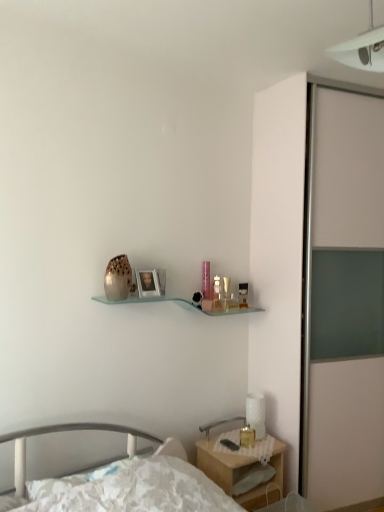
Question: Is white textured table lamp at lower right located outside translucent glass perfume bottle at upper center, the first toiletry positioned from the front?

Choices:
 (A) yes
 (B) no

Answer: (A)

Question: Considering the relative positions of white textured table lamp at lower right and translucent glass perfume bottle at upper center, which appears as the second toiletry when viewed from the right, in the image provided, is white textured table lamp at lower right to the right of translucent glass perfume bottle at upper center, which appears as the second toiletry when viewed from the right, from the viewer's perspective?

Choices:
 (A) no
 (B) yes

Answer: (B)

Question: Is white textured table lamp at lower right positioned with its back to translucent glass perfume bottle at upper center, the first toiletry positioned from the front?

Choices:
 (A) no
 (B) yes

Answer: (A)

Question: From a real-world perspective, is white textured table lamp at lower right on translucent glass perfume bottle at upper center, which appears as the second toiletry when viewed from the right?

Choices:
 (A) yes
 (B) no

Answer: (B)

Question: From a real-world perspective, is white textured table lamp at lower right below translucent glass perfume bottle at upper center, the first toiletry positioned from the front?

Choices:
 (A) no
 (B) yes

Answer: (B)

Question: Considering the relative positions of white textured table lamp at lower right and translucent glass perfume bottle at upper center, the first toiletry positioned from the front, in the image provided, is white textured table lamp at lower right to the left of translucent glass perfume bottle at upper center, the first toiletry positioned from the front, from the viewer's perspective?

Choices:
 (A) yes
 (B) no

Answer: (B)

Question: From a real-world perspective, is translucent glass perfume bottle at upper center, the first toiletry from the left, on top of brown textured vase at center?

Choices:
 (A) no
 (B) yes

Answer: (A)

Question: Considering the relative sizes of translucent glass perfume bottle at upper center, which appears as the second toiletry when viewed from the right, and brown textured vase at center in the image provided, is translucent glass perfume bottle at upper center, which appears as the second toiletry when viewed from the right, bigger than brown textured vase at center?

Choices:
 (A) yes
 (B) no

Answer: (B)

Question: Is the position of translucent glass perfume bottle at upper center, the first toiletry from the left, less distant than that of brown textured vase at center?

Choices:
 (A) yes
 (B) no

Answer: (B)

Question: Can you confirm if translucent glass perfume bottle at upper center, the first toiletry from the left, is shorter than brown textured vase at center?

Choices:
 (A) no
 (B) yes

Answer: (B)

Question: Does translucent glass perfume bottle at upper center, which appears as the second toiletry when viewed from the right, have a greater height compared to brown textured vase at center?

Choices:
 (A) yes
 (B) no

Answer: (B)

Question: Does translucent glass perfume bottle at upper center, positioned as the second toiletry in back-to-front order, have a smaller size compared to brown textured vase at center?

Choices:
 (A) no
 (B) yes

Answer: (B)

Question: From a real-world perspective, is matte silver picture frame at center over translucent glass candle at bedside?

Choices:
 (A) no
 (B) yes

Answer: (B)